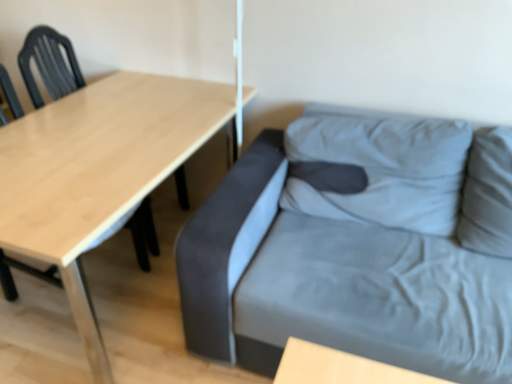
Question: Does wooden table at left have a larger size compared to suede gray couch at right?

Choices:
 (A) yes
 (B) no

Answer: (B)

Question: Could you tell me if wooden table at left is turned towards suede gray couch at right?

Choices:
 (A) no
 (B) yes

Answer: (B)

Question: Is wooden table at left taller than suede gray couch at right?

Choices:
 (A) no
 (B) yes

Answer: (A)

Question: From a real-world perspective, is wooden table at left on suede gray couch at right?

Choices:
 (A) no
 (B) yes

Answer: (A)

Question: Can we say wooden table at left lies outside suede gray couch at right?

Choices:
 (A) no
 (B) yes

Answer: (B)

Question: From the image's perspective, is matte black chair at left above or below suede gray couch at right?

Choices:
 (A) below
 (B) above

Answer: (B)

Question: Visually, is matte black chair at left positioned to the left or to the right of suede gray couch at right?

Choices:
 (A) left
 (B) right

Answer: (A)

Question: In terms of width, does matte black chair at left look wider or thinner when compared to suede gray couch at right?

Choices:
 (A) thin
 (B) wide

Answer: (A)

Question: Considering the positions of point (20, 263) and point (365, 284), is point (20, 263) closer or farther from the camera than point (365, 284)?

Choices:
 (A) closer
 (B) farther

Answer: (B)

Question: Considering the positions of wooden table at left and matte black chair at left in the image, is wooden table at left wider or thinner than matte black chair at left?

Choices:
 (A) thin
 (B) wide

Answer: (B)

Question: From a real-world perspective, is wooden table at left physically located above or below matte black chair at left?

Choices:
 (A) below
 (B) above

Answer: (A)

Question: Considering the positions of wooden table at left and matte black chair at left in the image, is wooden table at left bigger or smaller than matte black chair at left?

Choices:
 (A) small
 (B) big

Answer: (B)

Question: Based on their positions, is wooden table at left located to the left or right of matte black chair at left?

Choices:
 (A) right
 (B) left

Answer: (A)

Question: From the image's perspective, is suede gray couch at right above or below matte black chair at left?

Choices:
 (A) above
 (B) below

Answer: (B)

Question: From a real-world perspective, relative to matte black chair at left, is suede gray couch at right vertically above or below?

Choices:
 (A) above
 (B) below

Answer: (B)